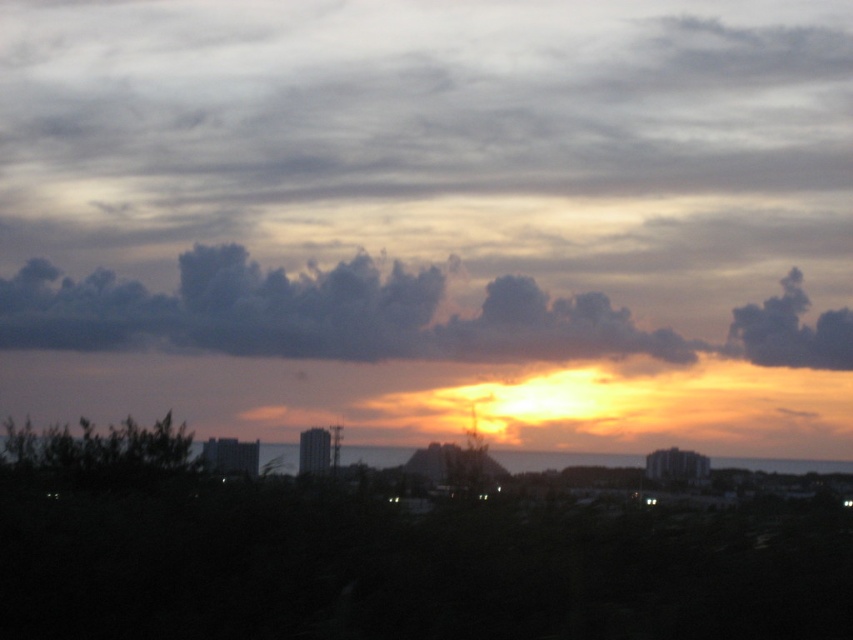
Is gray/cloudy sky at upper shorter than dark gray fluffy clouds at upper center?

No.

Can you confirm if gray/cloudy sky at upper is positioned below dark gray fluffy clouds at upper center?

Incorrect, gray/cloudy sky at upper is not positioned below dark gray fluffy clouds at upper center.

Between point (799, 163) and point (68, 326), which one is positioned in front?

Point (799, 163) is more forward.

I want to click on gray/cloudy sky at upper, so click(x=418, y=100).